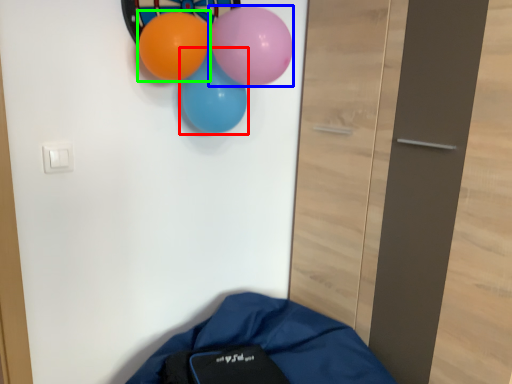
Question: Which is farther away from balloon (highlighted by a red box)? balloon (highlighted by a blue box) or balloon (highlighted by a green box)?

Choices:
 (A) balloon
 (B) balloon

Answer: (A)